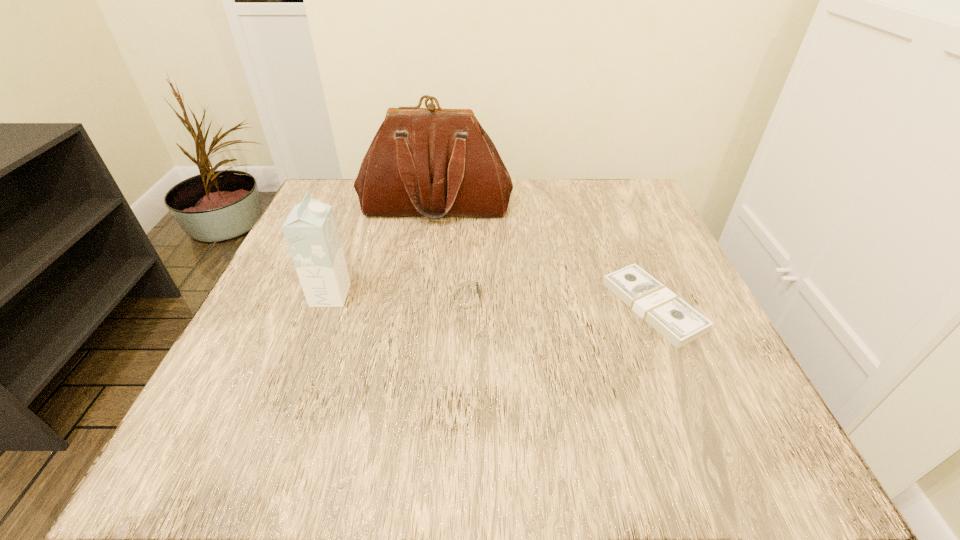
Identify which object is located as the second nearest to the shortest object. Please provide its 2D coordinates. Your answer should be formatted as a tuple, i.e. [(x, y)], where the tuple contains the x and y coordinates of a point satisfying the conditions above.

[(432, 162)]

Find the location of a particular element. The image size is (960, 540). free spot that satisfies the following two spatial constraints: 1. on the face of the rightmost object; 2. on the right side of the second shortest object is located at coordinates (467, 306).

Where is `blank space that satisfies the following two spatial constraints: 1. on the back side of the shortest object; 2. on the front label of the second tallest object`? The image size is (960, 540). blank space that satisfies the following two spatial constraints: 1. on the back side of the shortest object; 2. on the front label of the second tallest object is located at coordinates (648, 295).

Where is `vacant space that satisfies the following two spatial constraints: 1. on the face of the second shortest object; 2. on the right side of the dollar`? This screenshot has width=960, height=540. vacant space that satisfies the following two spatial constraints: 1. on the face of the second shortest object; 2. on the right side of the dollar is located at coordinates (467, 306).

Identify the location of vacant space that satisfies the following two spatial constraints: 1. on the front label of the carton; 2. on the left side of the dollar. This screenshot has width=960, height=540. (326, 306).

Locate an element on the screen. Image resolution: width=960 pixels, height=540 pixels. vacant space that satisfies the following two spatial constraints: 1. on the front label of the carton; 2. on the right side of the rightmost object is located at coordinates 326,306.

This screenshot has height=540, width=960. Identify the location of vacant area in the image that satisfies the following two spatial constraints: 1. on the back side of the dollar; 2. on the face of the watch. (648, 295).

Locate an element on the screen. The width and height of the screenshot is (960, 540). vacant space that satisfies the following two spatial constraints: 1. on the front side of the tallest object; 2. on the front label of the carton is located at coordinates (423, 295).